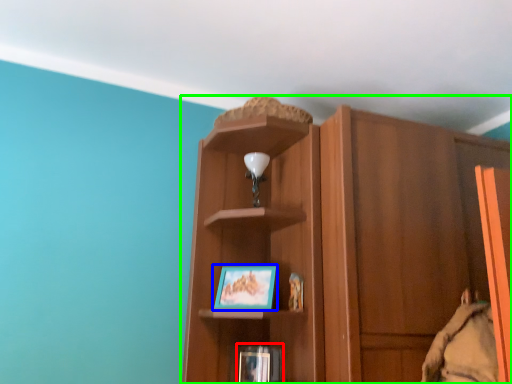
Question: Considering the real-world distances, which object is farthest from book (highlighted by a red box)? picture frame (highlighted by a blue box) or cupboard (highlighted by a green box)?

Choices:
 (A) picture frame
 (B) cupboard

Answer: (B)